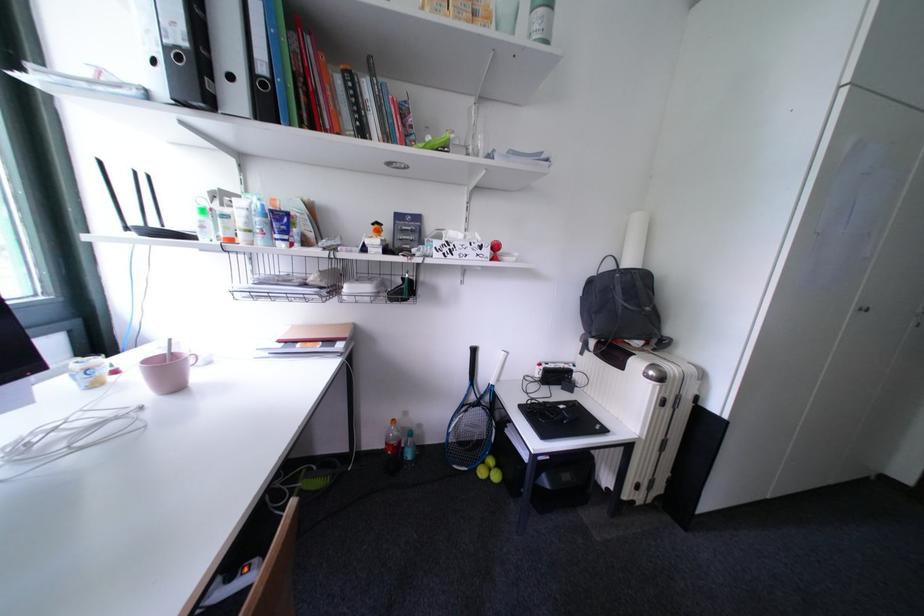
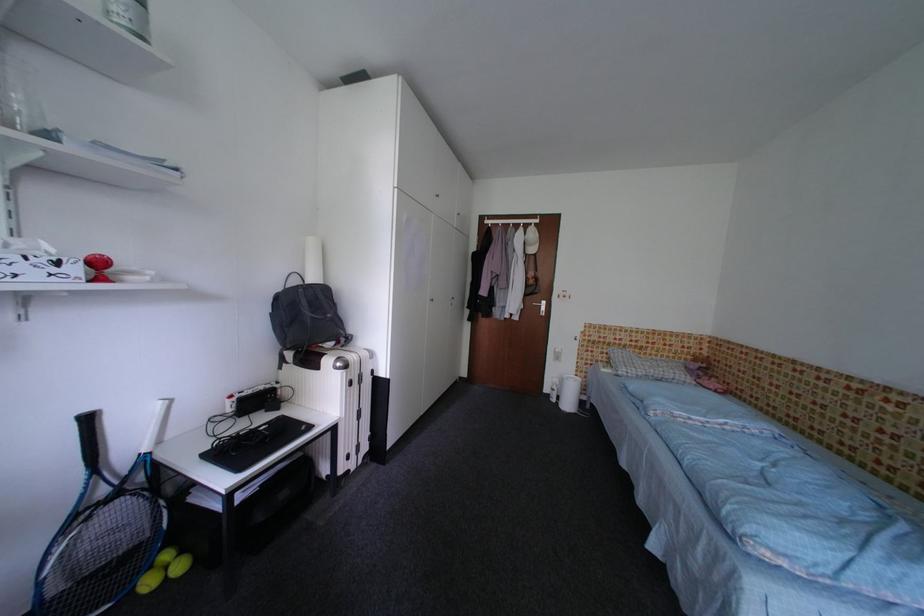
The point at (490, 475) is marked in the first image. Where is the corresponding point in the second image?

(156, 586)